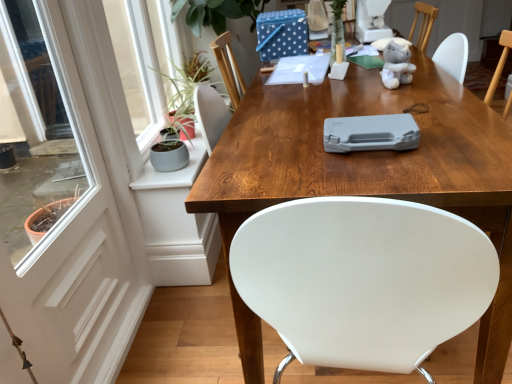
Image resolution: width=512 pixels, height=384 pixels. Describe the element at coordinates (372, 166) in the screenshot. I see `wooden table at center` at that location.

Where is `soft gray plush bear at upper right`? soft gray plush bear at upper right is located at coordinates (397, 63).

Is wooden table at center looking in the opposite direction of white glossy screen door at left?

Yes.

In the scene shown: Are wooden table at center and white glossy screen door at left located far from each other?

They are positioned close to each other.

From the image's perspective, is wooden table at center above white glossy screen door at left?

Yes, from the image's perspective, wooden table at center is over white glossy screen door at left.

Is the depth of wooden table at center less than that of white glossy screen door at left?

No, it is not.

At what (x,y) coordinates should I click in order to perform the action: click on table located on the left of soft gray plush bear at upper right. Please return your answer as a coordinate pair (x, y). Image resolution: width=512 pixels, height=384 pixels. Looking at the image, I should click on (372, 166).

Which object is closer to the camera, soft gray plush bear at upper right or wooden table at center?

wooden table at center is closer to the camera.

Based on their positions, is soft gray plush bear at upper right located to the left or right of wooden table at center?

From the image, it's evident that soft gray plush bear at upper right is to the right of wooden table at center.

From a real-world perspective, is soft gray plush bear at upper right positioned under wooden table at center based on gravity?

No, from a real-world perspective, soft gray plush bear at upper right is not below wooden table at center.

Is wooden table at center at the right side of soft gray plush bear at upper right?

No.

Does wooden table at center have a lesser height compared to soft gray plush bear at upper right?

No.

Find the location of a particular element. The image size is (512, 384). toy on the right of wooden table at center is located at coordinates (397, 63).

Does point (479, 224) come behind point (386, 62)?

No, (479, 224) is in front of (386, 62).

Is white glossy screen door at left placed right next to soft gray plush bear at upper right?

white glossy screen door at left and soft gray plush bear at upper right are not in contact.

Considering the relative sizes of white glossy screen door at left and soft gray plush bear at upper right in the image provided, is white glossy screen door at left bigger than soft gray plush bear at upper right?

Indeed, white glossy screen door at left has a larger size compared to soft gray plush bear at upper right.

Which of these two, white glossy screen door at left or soft gray plush bear at upper right, stands shorter?

soft gray plush bear at upper right is shorter.

What's the angular difference between white glossy screen door at left and soft gray plush bear at upper right's facing directions?

56 degrees.

Is the position of soft gray plush bear at upper right more distant than that of white glossy screen door at left?

Yes, soft gray plush bear at upper right is further from the camera.

Which of these two, soft gray plush bear at upper right or white glossy screen door at left, is thinner?

white glossy screen door at left.

From the image's perspective, relative to white glossy screen door at left, is soft gray plush bear at upper right above or below?

soft gray plush bear at upper right is above white glossy screen door at left.

Considering the positions of points (144, 270) and (275, 122), is point (144, 270) closer to camera compared to point (275, 122)?

No, it is not.

Measure the distance between white glossy screen door at left and wooden table at center.

The distance of white glossy screen door at left from wooden table at center is 71.13 centimeters.

Considering the positions of objects white glossy screen door at left and wooden table at center in the image provided, who is more to the left, white glossy screen door at left or wooden table at center?

white glossy screen door at left.

Can we say white glossy screen door at left lies outside wooden table at center?

white glossy screen door at left is positioned outside wooden table at center.

Image resolution: width=512 pixels, height=384 pixels. Find the location of `table located underneath the white glossy screen door at left (from a real-world perspective)`. table located underneath the white glossy screen door at left (from a real-world perspective) is located at coordinates (372, 166).

In order to click on table that appears on the left of soft gray plush bear at upper right in this screenshot , I will do `click(372, 166)`.

Considering their positions, is soft gray plush bear at upper right positioned further to wooden table at center than white glossy screen door at left?

white glossy screen door at left lies further to wooden table at center than the other object.

From the image, which object appears to be farther from white glossy screen door at left, wooden table at center or soft gray plush bear at upper right?

soft gray plush bear at upper right.

Estimate the real-world distances between objects in this image. Which object is further from soft gray plush bear at upper right, wooden table at center or white glossy screen door at left?

white glossy screen door at left is further to soft gray plush bear at upper right.

Considering their positions, is soft gray plush bear at upper right positioned further to white glossy screen door at left than wooden table at center?

→ soft gray plush bear at upper right is positioned further to the anchor white glossy screen door at left.

Based on their spatial positions, is white glossy screen door at left or wooden table at center further from soft gray plush bear at upper right?

white glossy screen door at left is further to soft gray plush bear at upper right.

From the image, which object appears to be nearer to wooden table at center, white glossy screen door at left or soft gray plush bear at upper right?

Among the two, soft gray plush bear at upper right is located nearer to wooden table at center.

I want to click on table located between white glossy screen door at left and soft gray plush bear at upper right in the left-right direction, so click(372, 166).